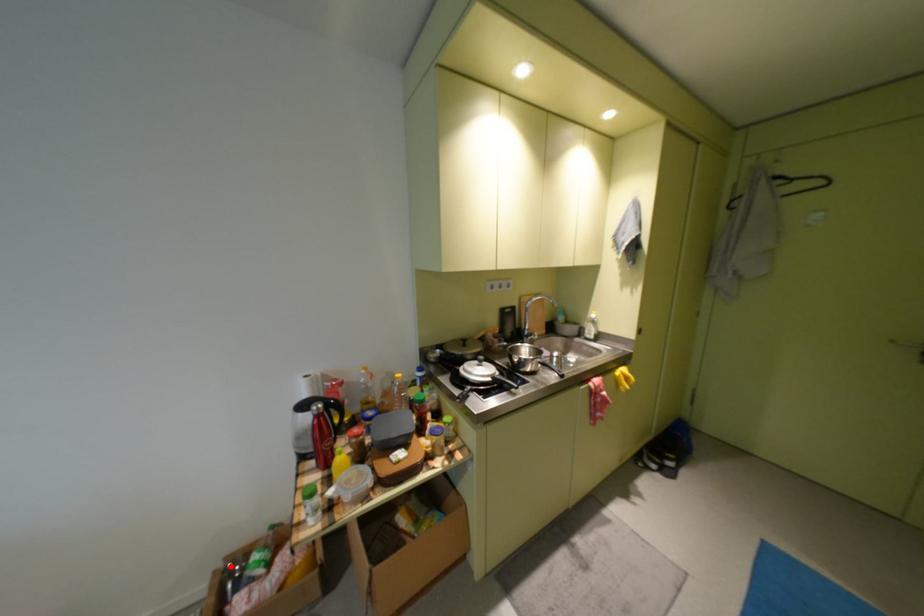
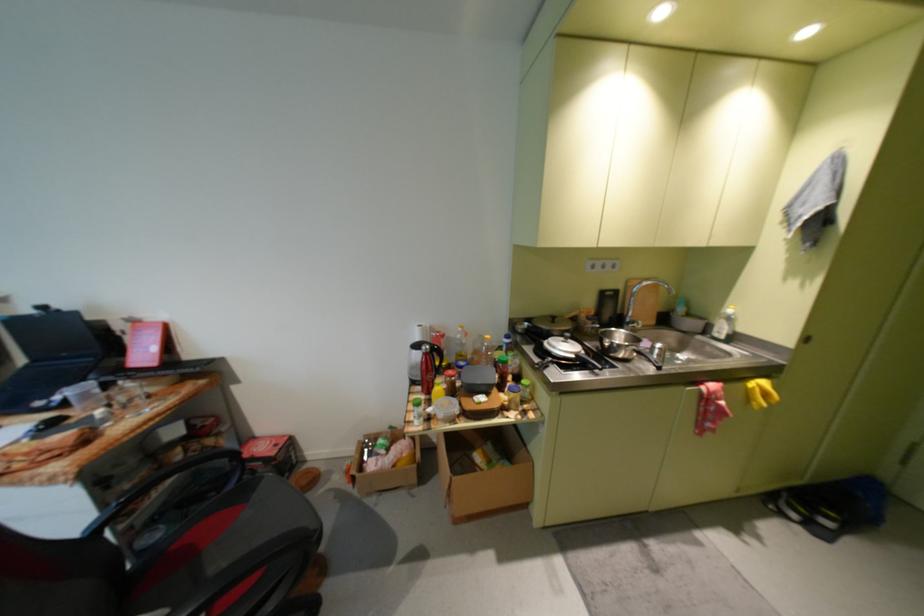
Question: I am providing you with two images of the same scene from different viewpoints. A red point is shown in image1. For the corresponding object point in image2, is it positioned nearer or farther from the camera?

Choices:
 (A) Nearer
 (B) Farther

Answer: (B)